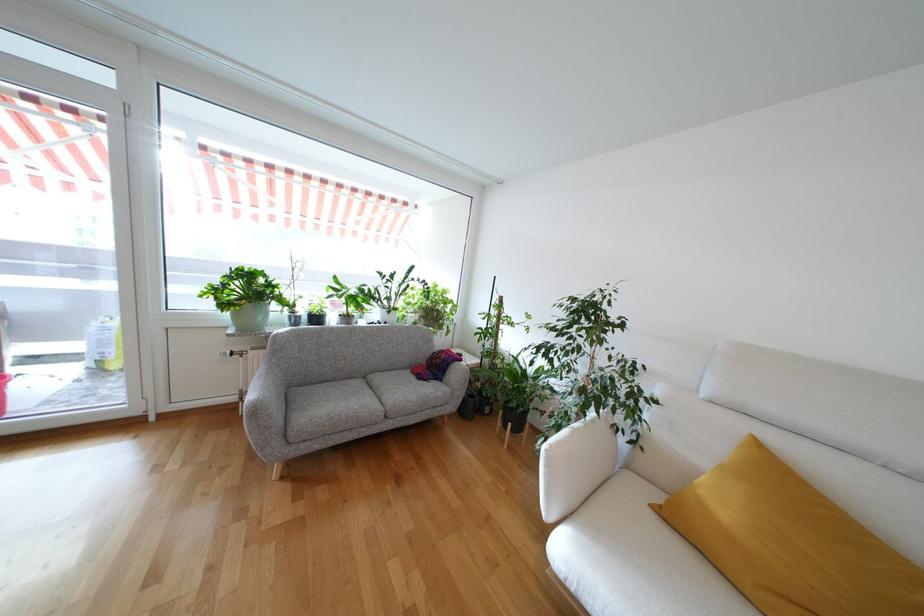
At what (x,y) coordinates should I click in order to perform the action: click on grey sofa armrest. Please return your answer as a coordinate pair (x, y). Looking at the image, I should click on (265, 390).